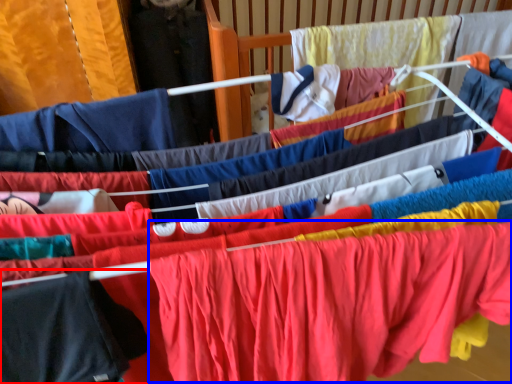
Question: Which point is further to the camera, clothing (highlighted by a red box) or clothing (highlighted by a blue box)?

Choices:
 (A) clothing
 (B) clothing

Answer: (B)